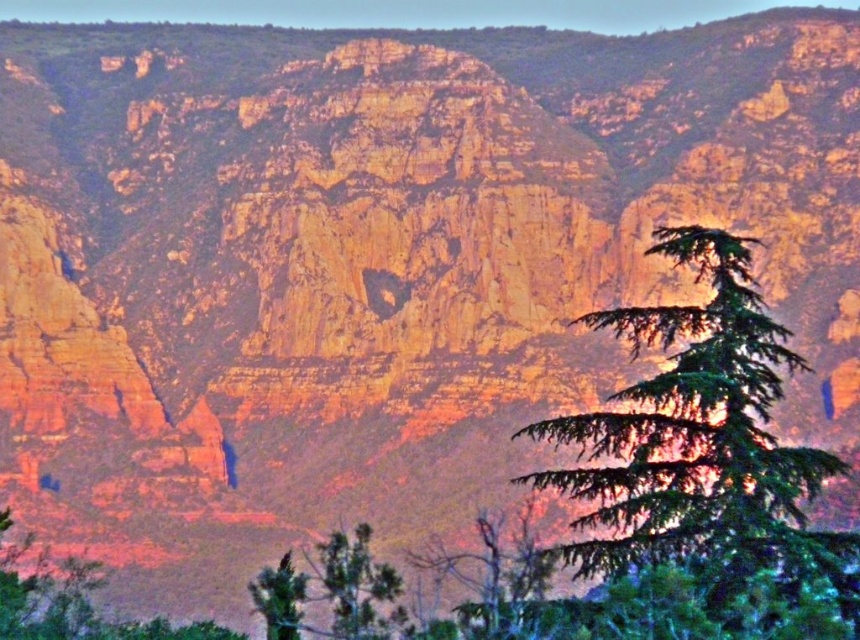
Question: Which point is farther from the camera taking this photo?

Choices:
 (A) tap(301, 600)
 (B) tap(796, 564)
 (C) tap(357, 556)

Answer: (C)

Question: Which point appears closest to the camera in this image?

Choices:
 (A) (262, 573)
 (B) (354, 592)
 (C) (705, 234)

Answer: (C)

Question: Is green matte tree at center to the left of green matte tree at lower center from the viewer's perspective?

Choices:
 (A) yes
 (B) no

Answer: (B)

Question: Does green needle-like tree at right have a lesser width compared to green matte tree at lower center?

Choices:
 (A) yes
 (B) no

Answer: (B)

Question: Which point appears farthest from the camera in this image?

Choices:
 (A) [342, 580]
 (B) [846, 593]

Answer: (A)

Question: Is green matte tree at center positioned before green matte tree at lower center?

Choices:
 (A) yes
 (B) no

Answer: (A)